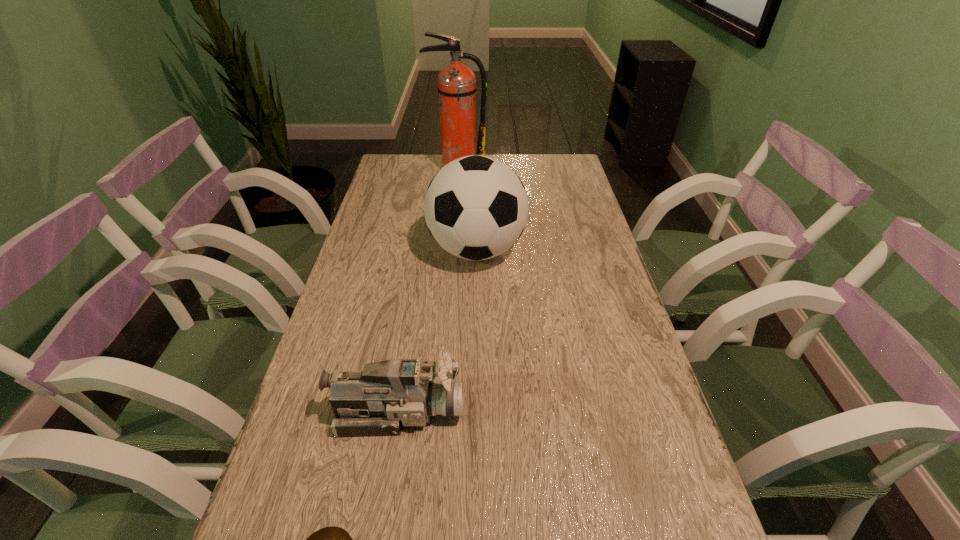
Image resolution: width=960 pixels, height=540 pixels. Find the location of `vacant region that satisfies the following two spatial constraints: 1. at the nozzle of the farthest object; 2. on the right side of the soccer ball`. vacant region that satisfies the following two spatial constraints: 1. at the nozzle of the farthest object; 2. on the right side of the soccer ball is located at coordinates (451, 250).

Locate an element on the screen. The width and height of the screenshot is (960, 540). free region that satisfies the following two spatial constraints: 1. at the nozzle of the farthest object; 2. on the front-facing side of the second shortest object is located at coordinates (438, 411).

The image size is (960, 540). I want to click on free location that satisfies the following two spatial constraints: 1. at the nozzle of the second tallest object; 2. on the left side of the tallest object, so click(451, 250).

The width and height of the screenshot is (960, 540). What are the coordinates of `vacant space that satisfies the following two spatial constraints: 1. at the nozzle of the farthest object; 2. on the front-facing side of the third tallest object` in the screenshot? It's located at (438, 411).